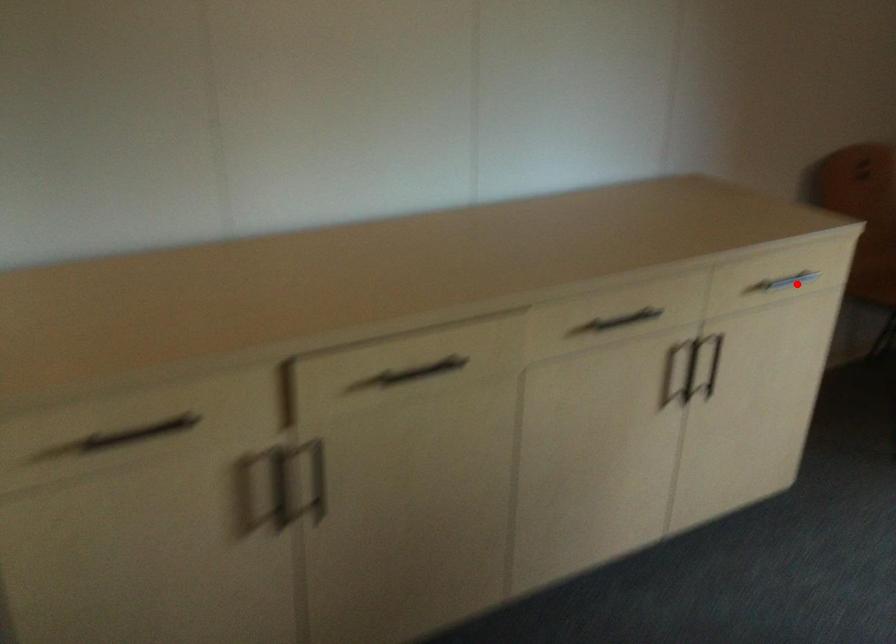
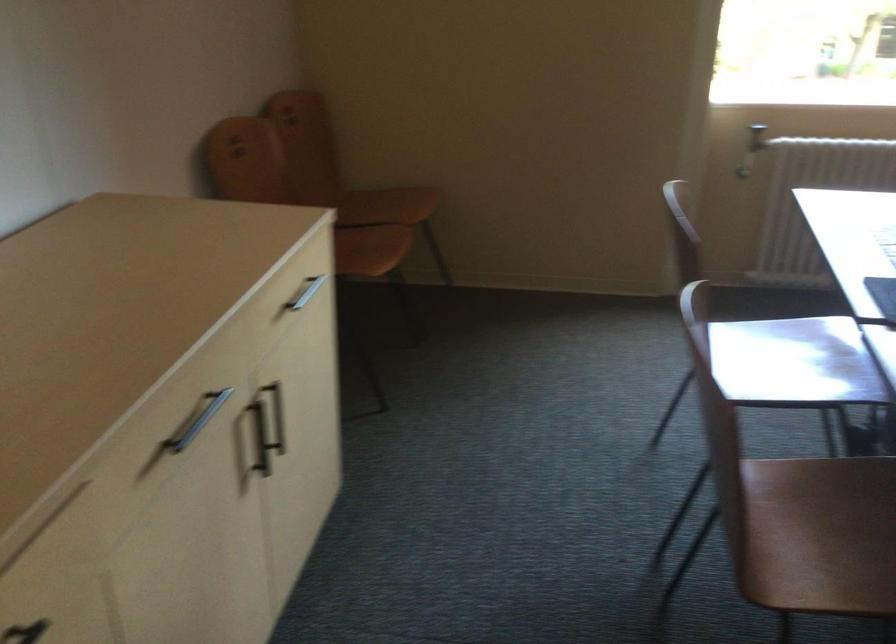
Question: I am providing you with two images of the same scene from different viewpoints. A red point is marked on the first image. Can you still see the location of the red point in image 2?

Choices:
 (A) Yes
 (B) No

Answer: (A)